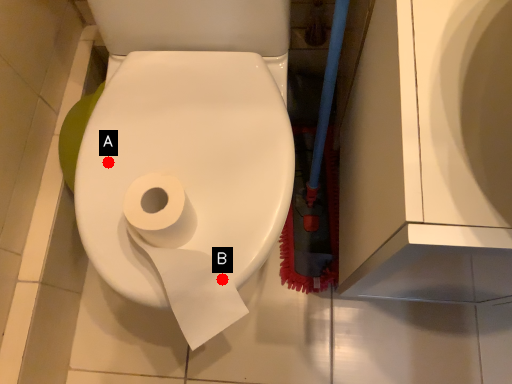
Question: Two points are circled on the image, labeled by A and B beside each circle. Which point appears farthest from the camera in this image?

Choices:
 (A) A is further
 (B) B is further

Answer: (A)